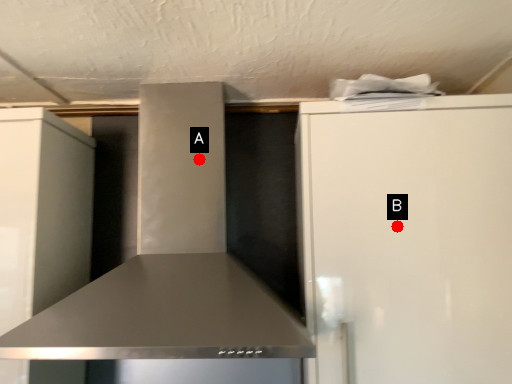
Question: Two points are circled on the image, labeled by A and B beside each circle. Which point is closer to the camera taking this photo?

Choices:
 (A) A is closer
 (B) B is closer

Answer: (B)